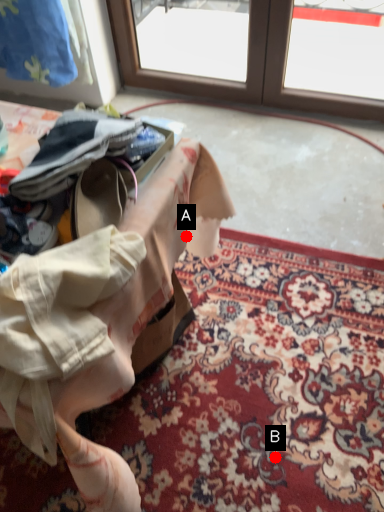
Question: Two points are circled on the image, labeled by A and B beside each circle. Which point is farther from the camera taking this photo?

Choices:
 (A) A is further
 (B) B is further

Answer: (A)